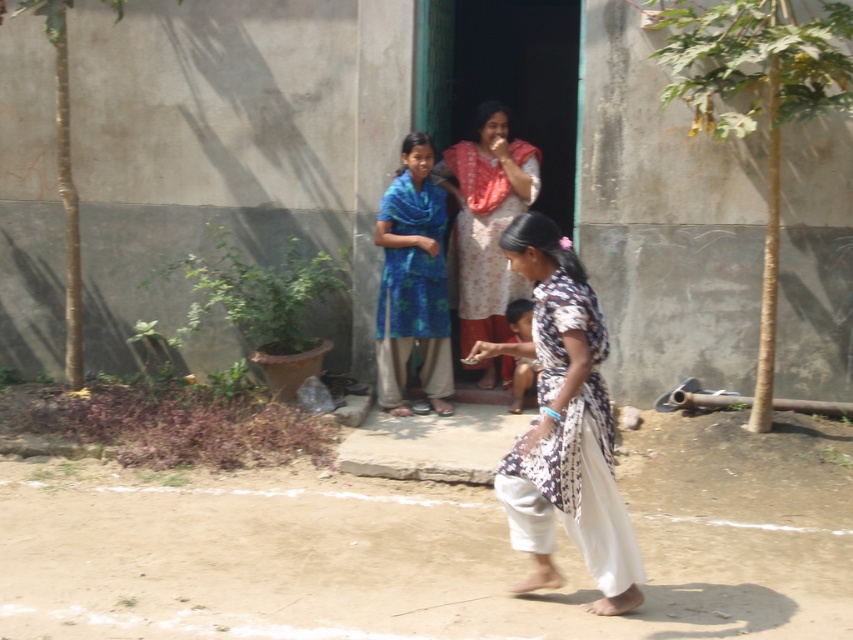
Between floral-patterned fabric at center and blue fabric dress at center, which one has more height?

With more height is blue fabric dress at center.

Can you confirm if floral-patterned fabric at center is taller than blue fabric dress at center?

No, floral-patterned fabric at center is not taller than blue fabric dress at center.

Is point (589, 492) closer to viewer compared to point (399, 253)?

Yes, point (589, 492) is closer to viewer.

Identify the location of floral-patterned fabric at center. (564, 426).

Can you confirm if floral-patterned fabric at center is wider than floral cotton dress at center?

In fact, floral-patterned fabric at center might be narrower than floral cotton dress at center.

In the scene shown: Can you confirm if floral-patterned fabric at center is positioned below floral cotton dress at center?

Yes, floral-patterned fabric at center is below floral cotton dress at center.

Locate an element on the screen. The image size is (853, 640). floral-patterned fabric at center is located at coordinates [x=564, y=426].

Is blue fabric dress at center closer to the viewer compared to floral cotton dress at center?

Yes.

Describe the element at coordinates (413, 284) in the screenshot. This screenshot has width=853, height=640. I see `blue fabric dress at center` at that location.

Which is behind, point (434, 237) or point (467, 330)?

Positioned behind is point (467, 330).

Image resolution: width=853 pixels, height=640 pixels. I want to click on blue fabric dress at center, so click(x=413, y=284).